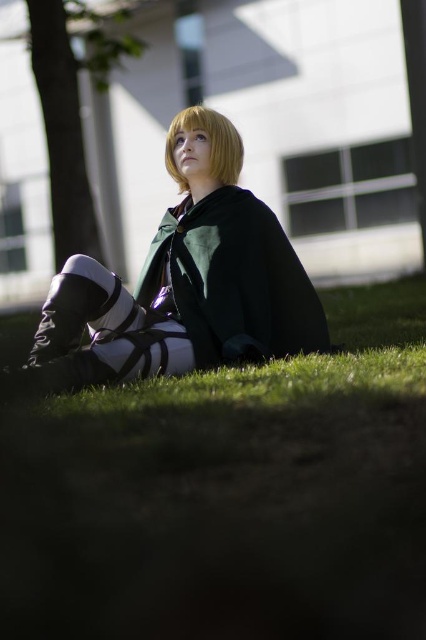
Who is lower down, green matte cape at center or blonde hair at upper center?

green matte cape at center is lower down.

Can you confirm if green matte cape at center is positioned above blonde hair at upper center?

Actually, green matte cape at center is below blonde hair at upper center.

You are a GUI agent. You are given a task and a screenshot of the screen. Output one action in this format:
    pyautogui.click(x=<x>, y=<y>)
    Task: Click on the green matte cape at center
    
    Given the screenshot: What is the action you would take?
    pyautogui.click(x=233, y=280)

Locate an element on the screen. green matte cape at center is located at coordinates [x=233, y=280].

Is point (81, 326) positioned before point (282, 330)?

Yes.

Image resolution: width=426 pixels, height=640 pixels. In order to click on matte green cape at center in this screenshot , I will do `click(181, 284)`.

Is matte green cape at center positioned before blonde hair at upper center?

Yes, matte green cape at center is in front of blonde hair at upper center.

Who is higher up, matte green cape at center or blonde hair at upper center?

blonde hair at upper center is above.

This screenshot has width=426, height=640. Find the location of `matte green cape at center`. matte green cape at center is located at coordinates tap(181, 284).